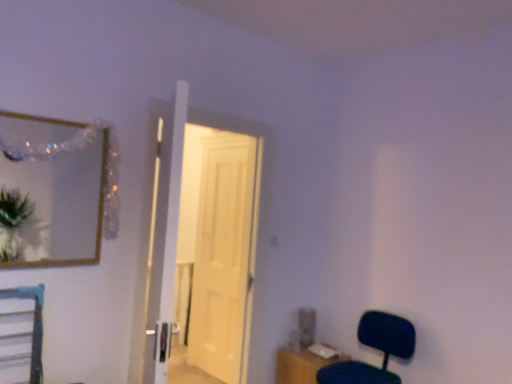
Question: Is wooden table at lower right far from white glossy door at center, the 2th door positioned from the front?

Choices:
 (A) yes
 (B) no

Answer: (B)

Question: Is wooden table at lower right taller than white glossy door at center, which ranks as the 1th door in back-to-front order?

Choices:
 (A) no
 (B) yes

Answer: (A)

Question: Does wooden table at lower right lie in front of white glossy door at center, the 2th door positioned from the front?

Choices:
 (A) yes
 (B) no

Answer: (A)

Question: From a real-world perspective, is wooden table at lower right positioned over white glossy door at center, the 2th door positioned from the front, based on gravity?

Choices:
 (A) no
 (B) yes

Answer: (A)

Question: Does wooden table at lower right have a lesser width compared to white glossy door at center, the 2th door positioned from the front?

Choices:
 (A) no
 (B) yes

Answer: (A)

Question: Does wooden table at lower right have a greater width compared to white glossy door at center, the 2th door positioned from the front?

Choices:
 (A) yes
 (B) no

Answer: (A)

Question: Considering the relative sizes of white glossy door at center, which ranks as the 1th door in back-to-front order, and wooden table at lower right in the image provided, is white glossy door at center, which ranks as the 1th door in back-to-front order, smaller than wooden table at lower right?

Choices:
 (A) no
 (B) yes

Answer: (A)

Question: Is white glossy door at center, which ranks as the 1th door in back-to-front order, in contact with wooden table at lower right?

Choices:
 (A) yes
 (B) no

Answer: (B)

Question: Considering the relative sizes of white glossy door at center, the 2th door positioned from the front, and wooden table at lower right in the image provided, is white glossy door at center, the 2th door positioned from the front, shorter than wooden table at lower right?

Choices:
 (A) yes
 (B) no

Answer: (B)

Question: Could you tell me if white glossy door at center, the 2th door positioned from the front, is facing wooden table at lower right?

Choices:
 (A) yes
 (B) no

Answer: (B)

Question: From a real-world perspective, is white glossy door at center, the 2th door positioned from the front, positioned over wooden table at lower right based on gravity?

Choices:
 (A) no
 (B) yes

Answer: (B)

Question: Can you confirm if white glossy door at center, which ranks as the 1th door in back-to-front order, is thinner than wooden table at lower right?

Choices:
 (A) no
 (B) yes

Answer: (B)

Question: Is matte black chair at lower right aimed at white wooden door at center, the second door from the back?

Choices:
 (A) no
 (B) yes

Answer: (A)